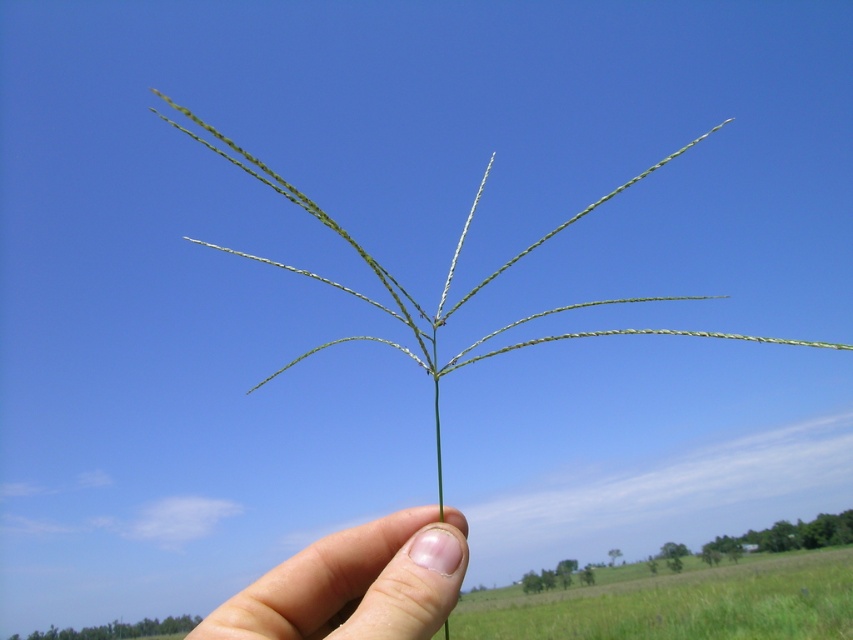
Question: Observing the image, what is the correct spatial positioning of green matte grass at center in reference to smooth skin at center?

Choices:
 (A) right
 (B) left

Answer: (A)

Question: Among these objects, which one is nearest to the camera?

Choices:
 (A) green matte grass at center
 (B) smooth skin at center

Answer: (B)

Question: Which point is farther to the camera?

Choices:
 (A) (422, 570)
 (B) (494, 637)

Answer: (B)

Question: Does green matte grass at center have a greater width compared to smooth skin at center?

Choices:
 (A) yes
 (B) no

Answer: (A)

Question: Can you confirm if green matte grass at center is wider than smooth skin at center?

Choices:
 (A) yes
 (B) no

Answer: (A)

Question: Which object appears farthest from the camera in this image?

Choices:
 (A) green matte grass at center
 (B) smooth skin at center

Answer: (A)